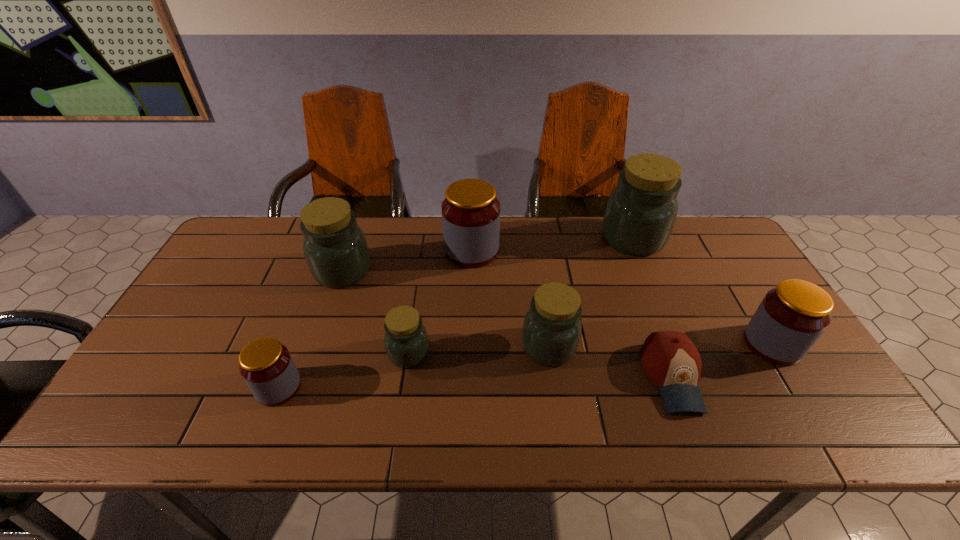
Where is `the tallest object`? the tallest object is located at coordinates (641, 211).

This screenshot has height=540, width=960. In order to click on the second jar from right to left in this screenshot , I will do `click(641, 211)`.

The height and width of the screenshot is (540, 960). I want to click on the fifth object from right to left, so click(470, 212).

You are a GUI agent. You are given a task and a screenshot of the screen. Output one action in this format:
    pyautogui.click(x=<x>, y=<y>)
    Task: Click on the farthest red jar
    This screenshot has width=960, height=540.
    Given the screenshot: What is the action you would take?
    pyautogui.click(x=470, y=212)

The image size is (960, 540). Find the location of `the leftmost green jar`. the leftmost green jar is located at coordinates (335, 248).

At what (x,y) coordinates should I click in order to perform the action: click on the third biggest green jar. Please return your answer as a coordinate pair (x, y). This screenshot has height=540, width=960. Looking at the image, I should click on (551, 332).

The image size is (960, 540). Identify the location of the fifth jar from left to right. (551, 332).

This screenshot has width=960, height=540. What are the coordinates of `the second farthest red jar` in the screenshot? It's located at coord(791,317).

This screenshot has width=960, height=540. What are the coordinates of `the rightmost jar` in the screenshot? It's located at (791, 317).

Where is `the nearest red jar`? the nearest red jar is located at coordinates (265, 364).